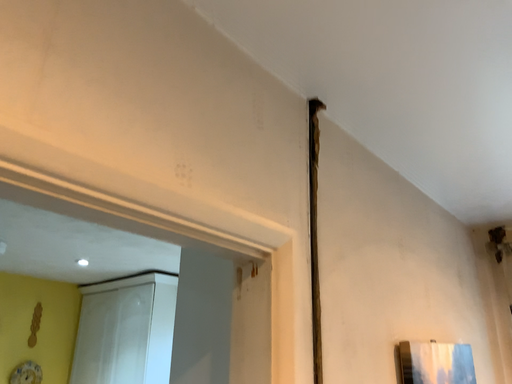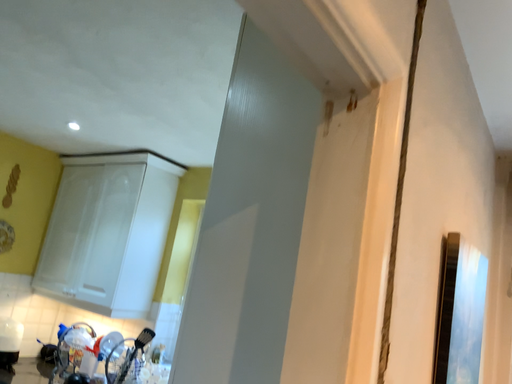
Question: Which way did the camera rotate in the video?

Choices:
 (A) rotated upward
 (B) rotated downward

Answer: (B)